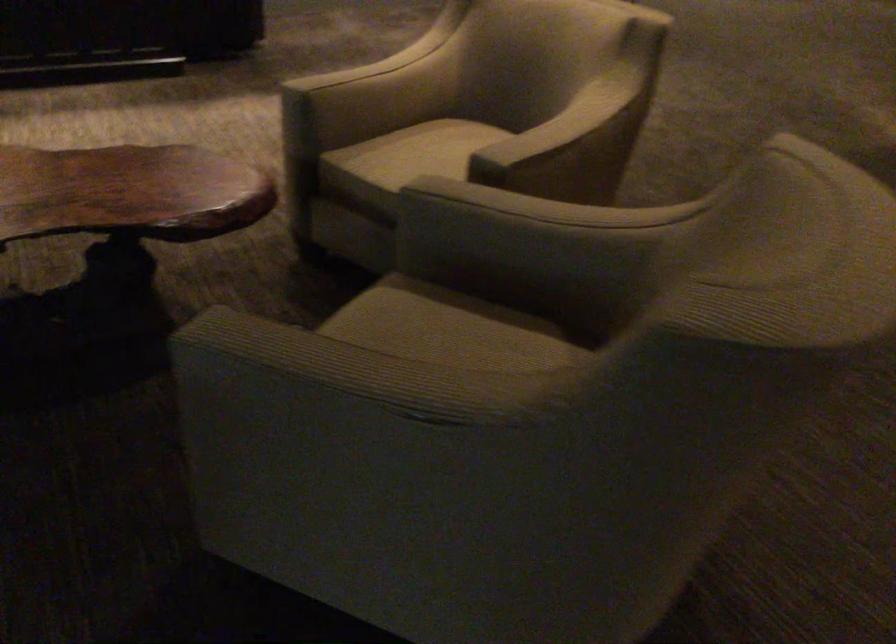
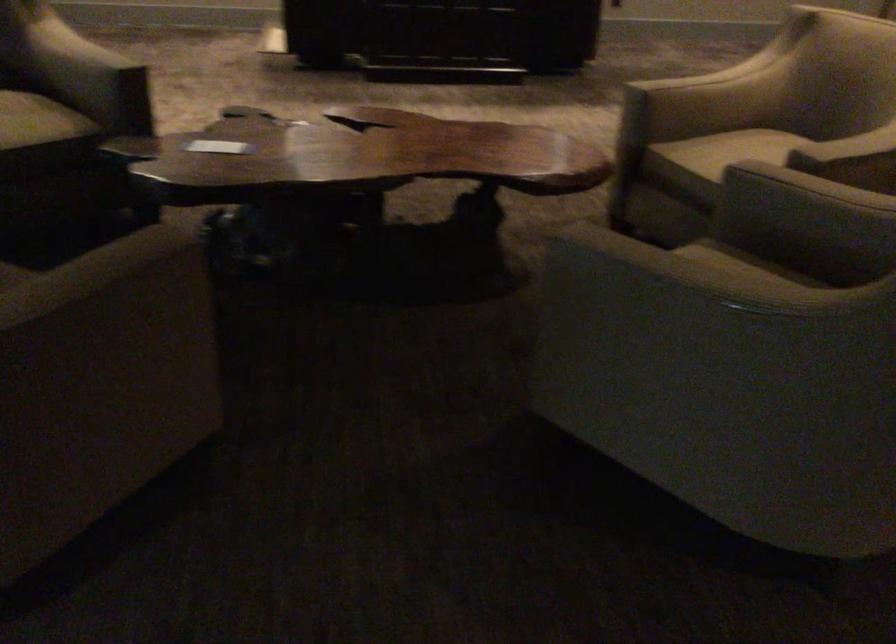
Find the pixel in the second image that matches [358,363] in the first image.

(690, 268)